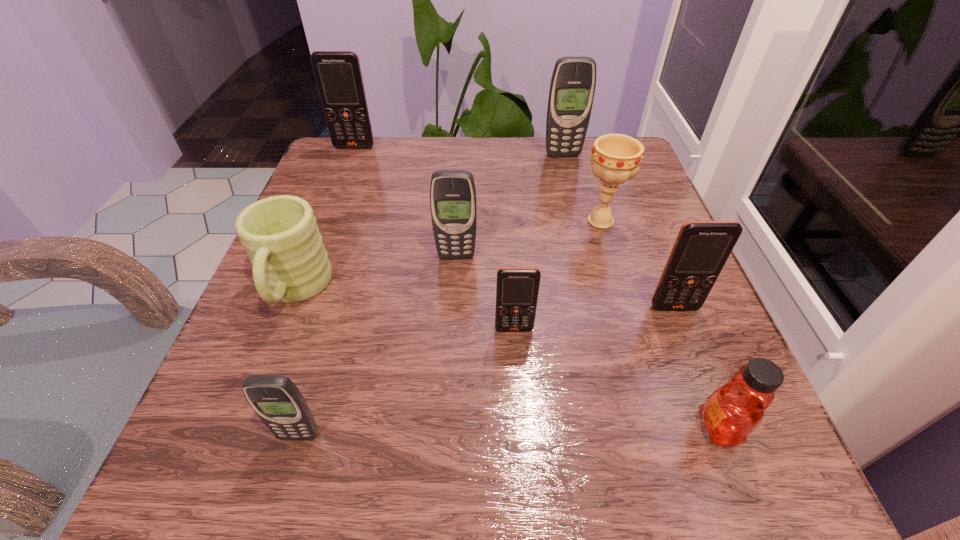
This screenshot has height=540, width=960. Find the location of `vacant space at the near left corner of the desktop`. vacant space at the near left corner of the desktop is located at coordinates (219, 469).

The width and height of the screenshot is (960, 540). Find the location of `free space at the near right corner of the desktop`. free space at the near right corner of the desktop is located at coordinates (789, 507).

This screenshot has height=540, width=960. In order to click on free point between the second gray cellular telephone from right to left and the seventh nearest object in this screenshot , I will do [528, 239].

At what (x,y) coordinates should I click in order to perform the action: click on free area in between the biggest gray cellular telephone and the third farthest object. Please return your answer as a coordinate pair (x, y). Looking at the image, I should click on (582, 188).

This screenshot has width=960, height=540. I want to click on blank region between the rightmost gray cellular telephone and the smallest gray cellular telephone, so click(x=431, y=295).

Where is `free area in between the leftmost gray cellular telephone and the rightmost cellular telephone`? This screenshot has width=960, height=540. free area in between the leftmost gray cellular telephone and the rightmost cellular telephone is located at coordinates (487, 372).

Find the location of a particular element. The width and height of the screenshot is (960, 540). vacant space that's between the nearest gray cellular telephone and the mug is located at coordinates (297, 363).

You are a GUI agent. You are given a task and a screenshot of the screen. Output one action in this format:
    pyautogui.click(x=<x>, y=<y>)
    Task: Click on the free space between the second smallest orange cellular telephone and the green mug
    The width and height of the screenshot is (960, 540).
    Given the screenshot: What is the action you would take?
    pyautogui.click(x=485, y=299)

Image resolution: width=960 pixels, height=540 pixels. Find the location of `free spot between the fourth cellular telephone from right to left and the green mug`. free spot between the fourth cellular telephone from right to left and the green mug is located at coordinates (375, 273).

Where is `free spot between the seventh nearest object and the second orange cellular telephone from left to right`? free spot between the seventh nearest object and the second orange cellular telephone from left to right is located at coordinates (558, 275).